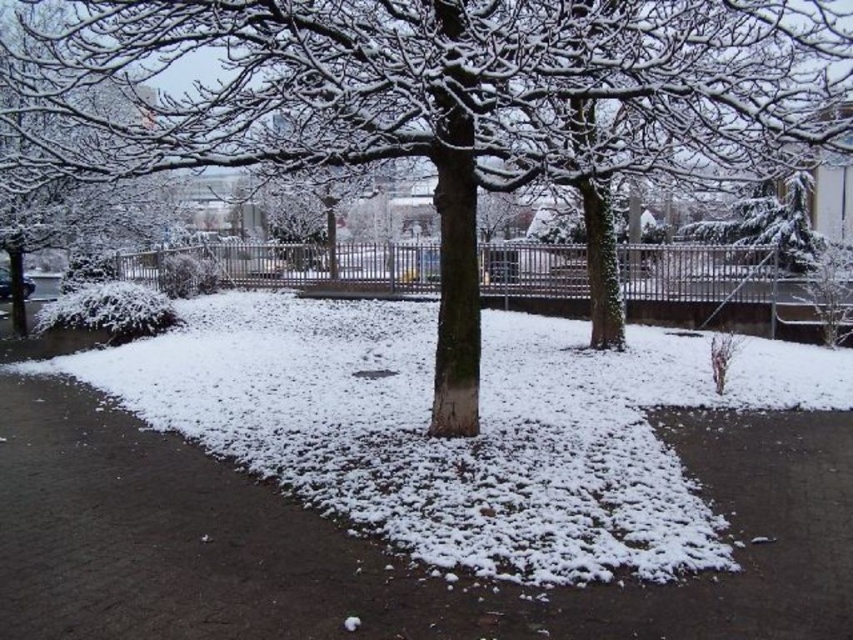
Question: Among these objects, which one is nearest to the camera?

Choices:
 (A) brown asphalt pavement at center
 (B) snow-covered tree at center

Answer: (A)

Question: Does brown asphalt pavement at center have a larger size compared to snow-covered tree at center?

Choices:
 (A) yes
 (B) no

Answer: (B)

Question: Which point is farther from the camera taking this photo?

Choices:
 (A) (42, 67)
 (B) (44, 588)

Answer: (A)

Question: Is brown asphalt pavement at center above snow-covered tree at center?

Choices:
 (A) yes
 (B) no

Answer: (B)

Question: Is brown asphalt pavement at center to the left of snow-covered tree at center from the viewer's perspective?

Choices:
 (A) yes
 (B) no

Answer: (B)